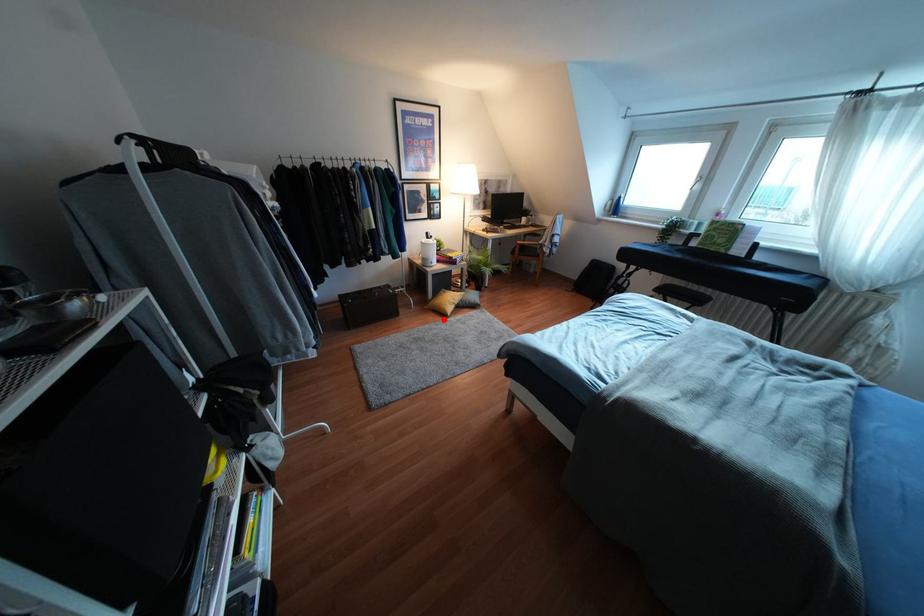
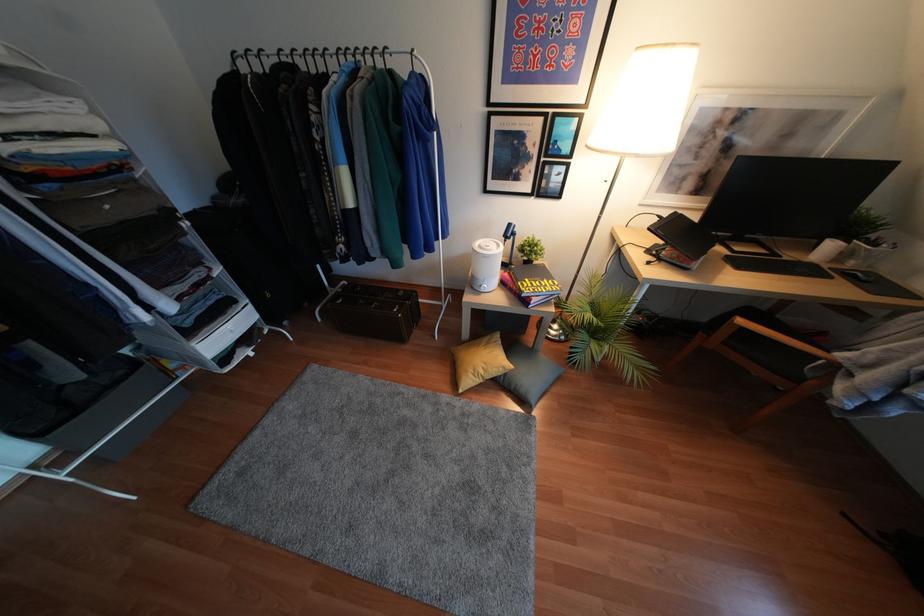
Find the pixel in the second image that matches the highlighted location in the first image.

(445, 397)